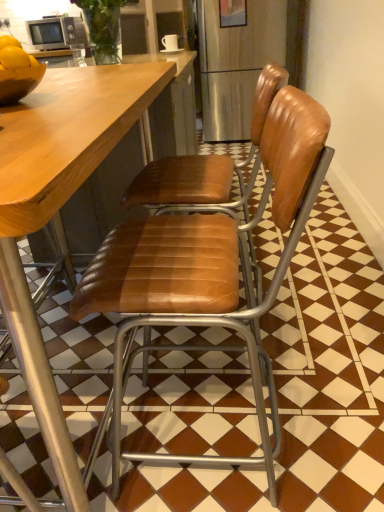
Identify the location of vacant space to the right of brown leather chair at center, acting as the second chair starting from the front. The width and height of the screenshot is (384, 512). (x=326, y=318).